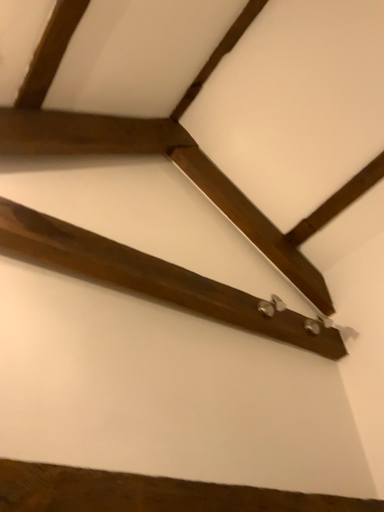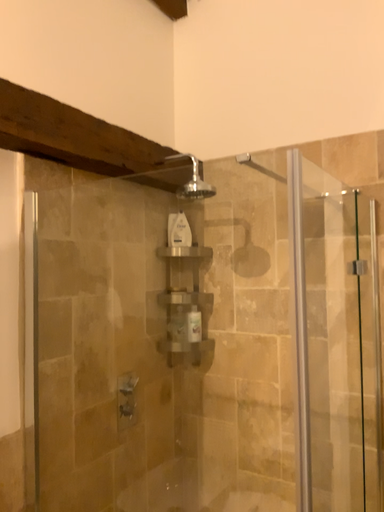
Question: Which way did the camera rotate in the video?

Choices:
 (A) rotated downward
 (B) rotated upward

Answer: (A)